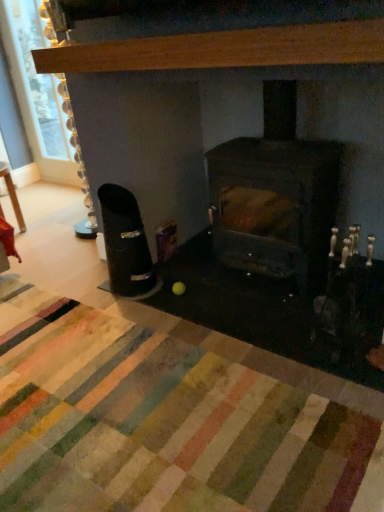
Question: Should I look upward or downward to see wooden table at left?

Choices:
 (A) down
 (B) up

Answer: (B)

Question: From the image's perspective, would you say dark brown wood burning stove at center is shown under wooden table at left?

Choices:
 (A) no
 (B) yes

Answer: (B)

Question: Does dark brown wood burning stove at center have a lesser height compared to wooden table at left?

Choices:
 (A) no
 (B) yes

Answer: (A)

Question: Can you confirm if dark brown wood burning stove at center is smaller than wooden table at left?

Choices:
 (A) yes
 (B) no

Answer: (B)

Question: Can we say dark brown wood burning stove at center lies outside wooden table at left?

Choices:
 (A) no
 (B) yes

Answer: (B)

Question: Would you say dark brown wood burning stove at center is a long distance from wooden table at left?

Choices:
 (A) no
 (B) yes

Answer: (B)

Question: Can you confirm if dark brown wood burning stove at center is taller than wooden table at left?

Choices:
 (A) no
 (B) yes

Answer: (B)

Question: Considering the relative sizes of black plastic ashtray at left and multicolored rug at center in the image provided, is black plastic ashtray at left wider than multicolored rug at center?

Choices:
 (A) yes
 (B) no

Answer: (B)

Question: Does black plastic ashtray at left turn towards multicolored rug at center?

Choices:
 (A) yes
 (B) no

Answer: (B)

Question: Is black plastic ashtray at left at the right side of multicolored rug at center?

Choices:
 (A) no
 (B) yes

Answer: (B)

Question: From a real-world perspective, is black plastic ashtray at left over multicolored rug at center?

Choices:
 (A) yes
 (B) no

Answer: (A)

Question: Considering the relative sizes of black plastic ashtray at left and multicolored rug at center in the image provided, is black plastic ashtray at left smaller than multicolored rug at center?

Choices:
 (A) no
 (B) yes

Answer: (B)

Question: Is black plastic ashtray at left outside multicolored rug at center?

Choices:
 (A) no
 (B) yes

Answer: (B)

Question: Is light brown wood mantel at upper center positioned beyond the bounds of clear glass window screen at upper left?

Choices:
 (A) yes
 (B) no

Answer: (A)